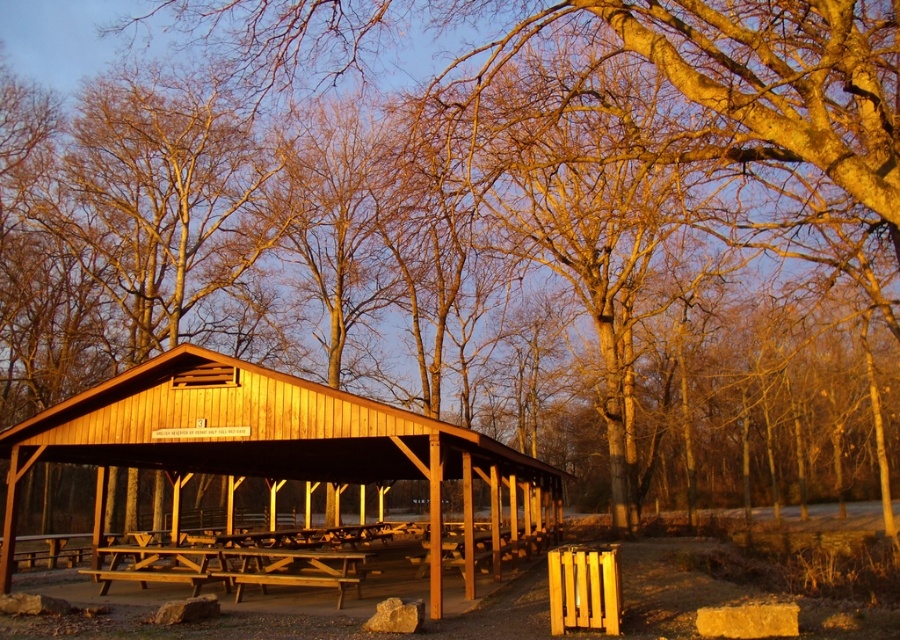
Question: Is wooden hut at center further to camera compared to wooden picnic table at center?

Choices:
 (A) no
 (B) yes

Answer: (A)

Question: From the image, what is the correct spatial relationship of wooden hut at center in relation to wooden picnic table at center?

Choices:
 (A) right
 (B) left

Answer: (A)

Question: Where is wooden hut at center located in relation to wooden picnic table at center in the image?

Choices:
 (A) left
 (B) right

Answer: (B)

Question: Among these objects, which one is nearest to the camera?

Choices:
 (A) wooden hut at center
 (B) wooden picnic table at center

Answer: (A)